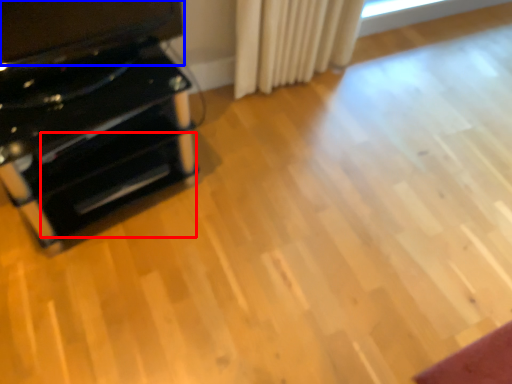
Question: Which object is closer to the camera taking this photo, drawer (highlighted by a red box) or wide (highlighted by a blue box)?

Choices:
 (A) drawer
 (B) wide

Answer: (B)